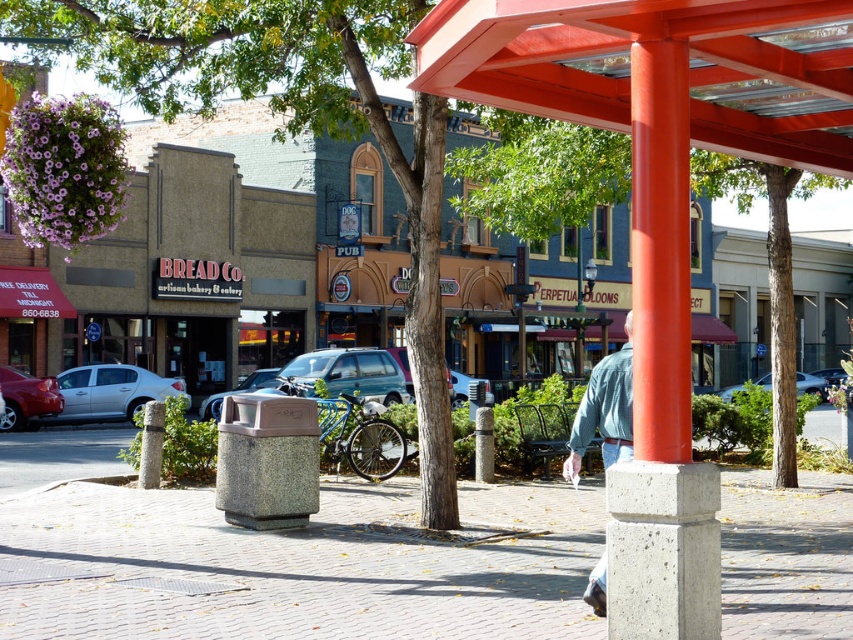
Question: Considering the real-world distances, which object is farthest from the gray concrete post at lower left?

Choices:
 (A) metallic red canopy at upper center
 (B) shiny red car at left
 (C) smooth concrete pillar at center
 (D) silver metallic sedan at left

Answer: (D)

Question: Which object is the closest to the metallic silver car at center?

Choices:
 (A) matte blue suv at center
 (B) metallic red canopy at upper center

Answer: (A)

Question: In this image, where is gray concrete post at lower left located relative to metallic silver car at center?

Choices:
 (A) above
 (B) below

Answer: (A)

Question: Does silver metallic sedan at left appear on the left side of shiny red car at left?

Choices:
 (A) yes
 (B) no

Answer: (B)

Question: Is smooth concrete pillar at center to the left of silver metallic sedan at left from the viewer's perspective?

Choices:
 (A) yes
 (B) no

Answer: (B)

Question: Estimate the real-world distances between objects in this image. Which object is farther from the silver metallic sedan at center?

Choices:
 (A) gray concrete post at lower left
 (B) matte blue suv at center

Answer: (B)